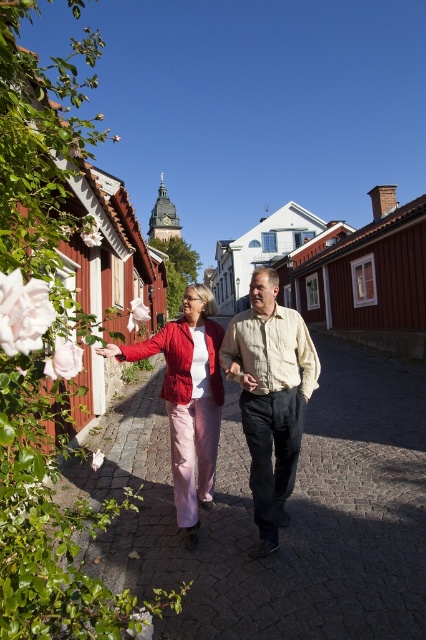
Question: Can you confirm if light beige cotton shirt at center is bigger than matte red jacket at center?

Choices:
 (A) yes
 (B) no

Answer: (B)

Question: Observing the image, what is the correct spatial positioning of pink fabric at center in reference to matte red jacket at center?

Choices:
 (A) below
 (B) above

Answer: (A)

Question: Which point is farther from the camera taking this photo?

Choices:
 (A) (124, 445)
 (B) (114, 346)
 (C) (296, 381)

Answer: (A)

Question: Is light beige cotton shirt at center thinner than matte red jacket at center?

Choices:
 (A) yes
 (B) no

Answer: (A)

Question: Which point appears farthest from the camera in this image?

Choices:
 (A) (138, 563)
 (B) (207, 378)

Answer: (B)

Question: Which of the following is the closest to the observer?

Choices:
 (A) pink fabric at center
 (B) matte red jacket at center

Answer: (A)